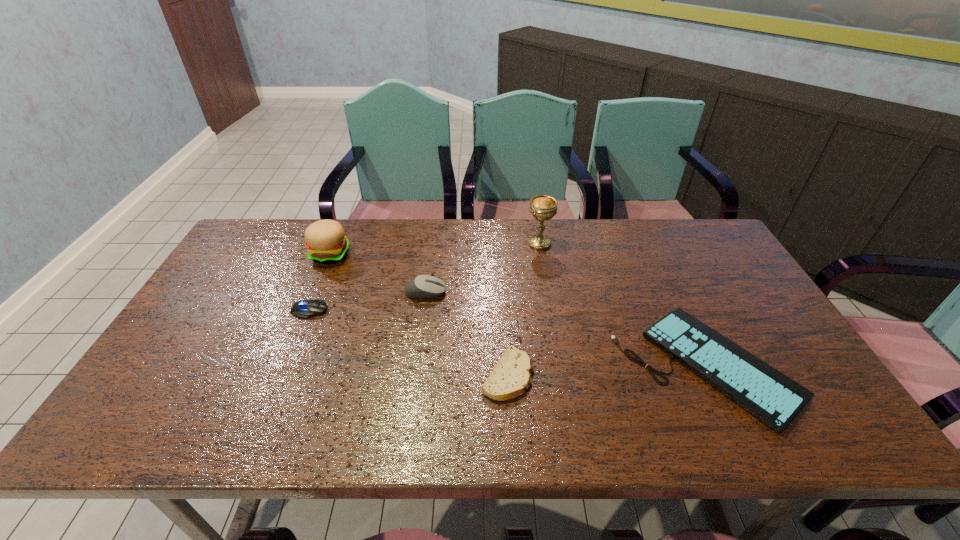
Identify the location of vacant space that satisfies the following two spatial constraints: 1. on the button side of the pita bread; 2. on the right side of the shorter computer mouse. This screenshot has height=540, width=960. (282, 375).